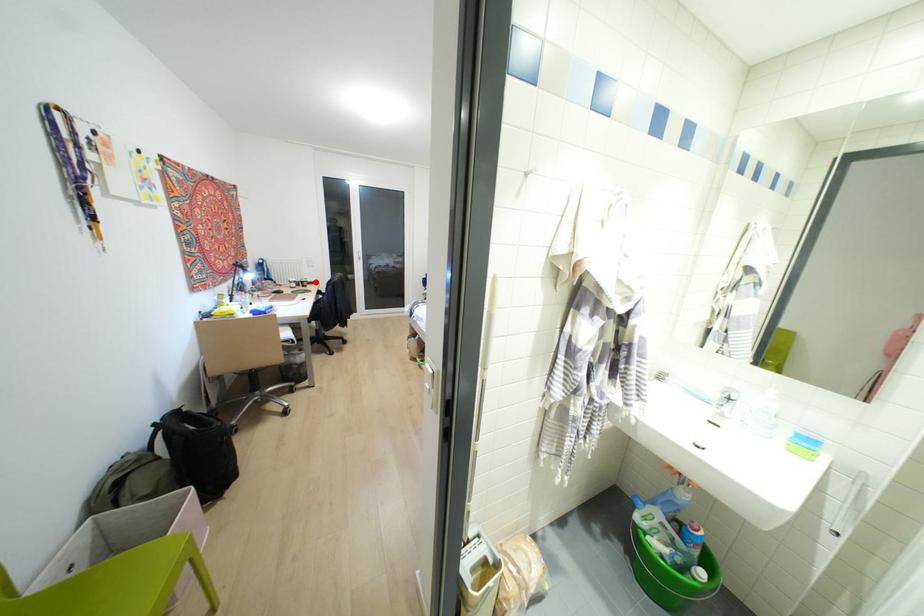
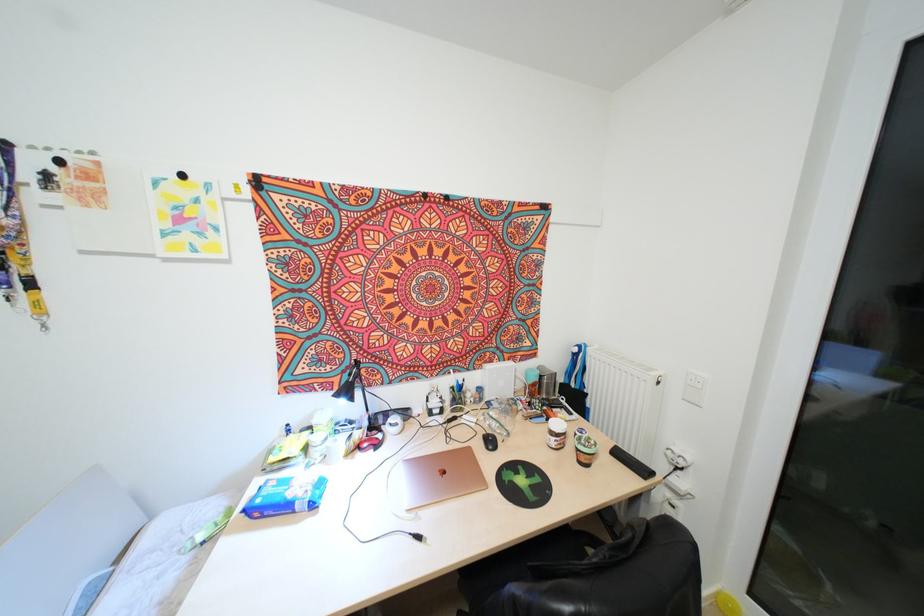
Locate, in the second image, the point that corresponds to the highlighted location in the first image.

(642, 471)